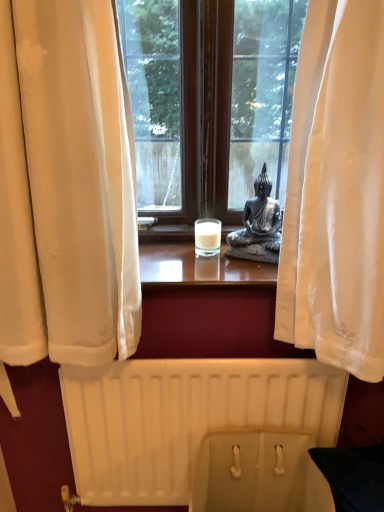
Question: Considering the relative sizes of white matte radiator at lower center and beige fabric toilet bowl at lower center in the image provided, is white matte radiator at lower center shorter than beige fabric toilet bowl at lower center?

Choices:
 (A) no
 (B) yes

Answer: (A)

Question: Does white matte radiator at lower center have a lesser width compared to beige fabric toilet bowl at lower center?

Choices:
 (A) no
 (B) yes

Answer: (B)

Question: Is white matte radiator at lower center not within beige fabric toilet bowl at lower center?

Choices:
 (A) yes
 (B) no

Answer: (A)

Question: From a real-world perspective, does white matte radiator at lower center stand above beige fabric toilet bowl at lower center?

Choices:
 (A) no
 (B) yes

Answer: (B)

Question: Can you confirm if white matte radiator at lower center is wider than beige fabric toilet bowl at lower center?

Choices:
 (A) no
 (B) yes

Answer: (A)

Question: From their relative heights in the image, would you say white matte radiator at lower center is taller or shorter than beige fabric toilet bowl at lower center?

Choices:
 (A) short
 (B) tall

Answer: (B)

Question: From the image's perspective, is white matte radiator at lower center positioned above or below beige fabric toilet bowl at lower center?

Choices:
 (A) below
 (B) above

Answer: (B)

Question: From a real-world perspective, is white matte radiator at lower center positioned above or below beige fabric toilet bowl at lower center?

Choices:
 (A) below
 (B) above

Answer: (B)

Question: In the image, is white matte radiator at lower center positioned in front of or behind beige fabric toilet bowl at lower center?

Choices:
 (A) behind
 (B) front

Answer: (A)

Question: In terms of height, does white matte radiator at lower center look taller or shorter compared to satin black statue at center?

Choices:
 (A) short
 (B) tall

Answer: (B)

Question: Is white matte radiator at lower center wider or thinner than satin black statue at center?

Choices:
 (A) wide
 (B) thin

Answer: (B)

Question: From a real-world perspective, relative to satin black statue at center, is white matte radiator at lower center vertically above or below?

Choices:
 (A) below
 (B) above

Answer: (A)

Question: Would you say white matte radiator at lower center is to the left or to the right of satin black statue at center in the picture?

Choices:
 (A) right
 (B) left

Answer: (B)

Question: Looking at the image, does beige fabric toilet bowl at lower center seem bigger or smaller compared to white matte radiator at lower center?

Choices:
 (A) big
 (B) small

Answer: (B)

Question: Is point (246, 504) closer or farther from the camera than point (130, 494)?

Choices:
 (A) closer
 (B) farther

Answer: (A)